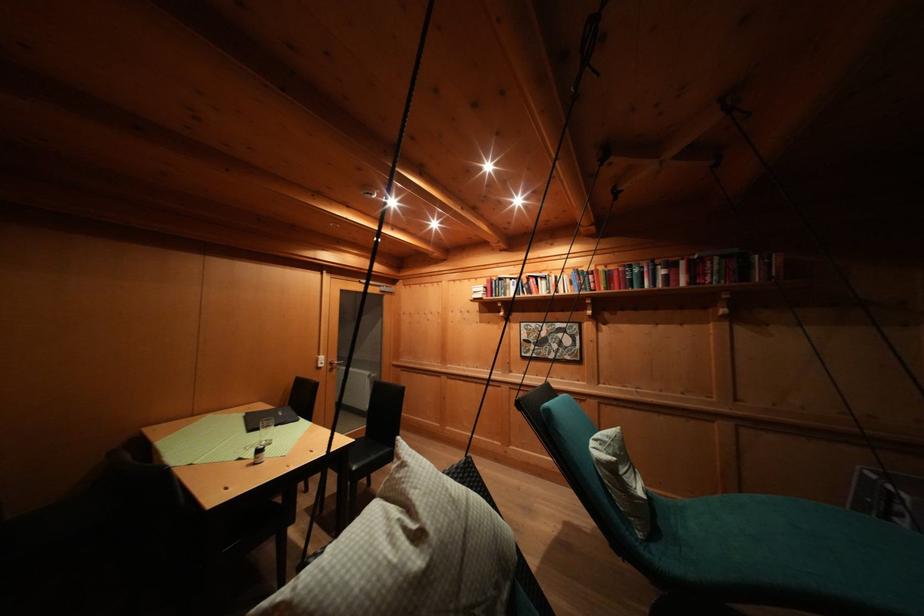
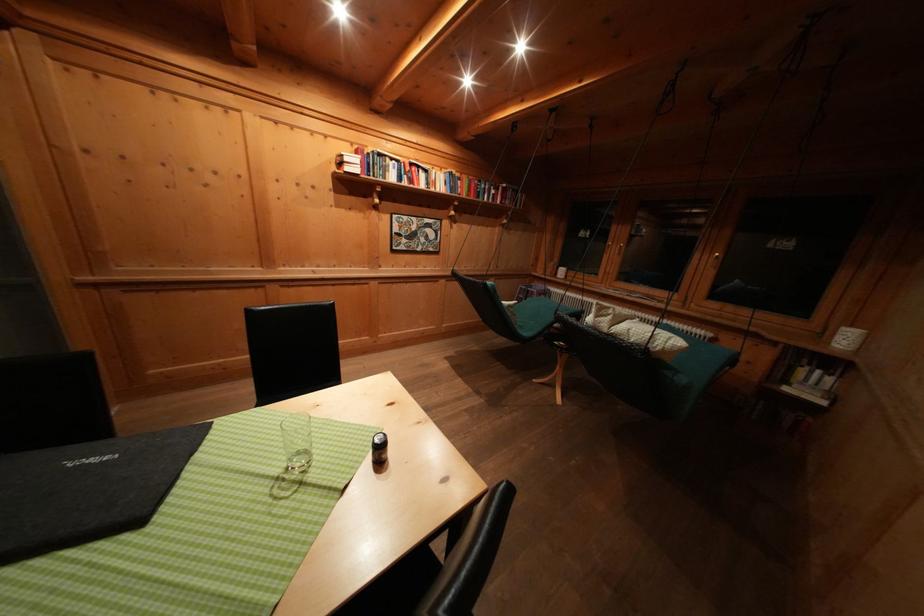
Question: I am providing you with two images of the same scene from different viewpoints. Which of the following objects are not visible in image2?

Choices:
 (A) red bucket handle
 (B) clear glass cup
 (C) hanging chair sitting surface
 (D) chair sitting surface

Answer: (D)